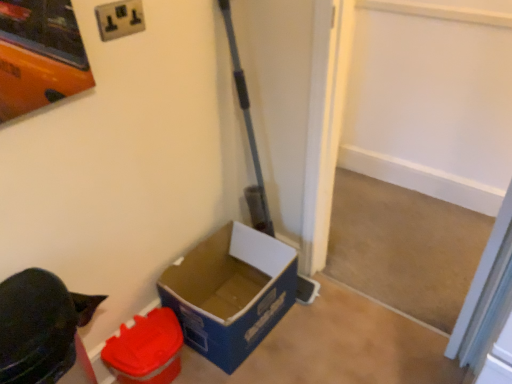
I want to click on vacant space situated above matte plastic container at lower left, the 1th box viewed from the left (from a real-world perspective), so click(141, 334).